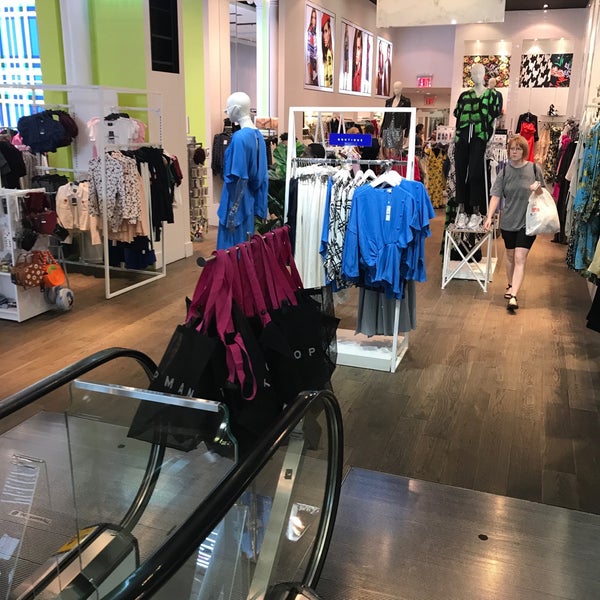
What are the coordinates of `hand rail` in the screenshot? It's located at (211, 534), (60, 366).